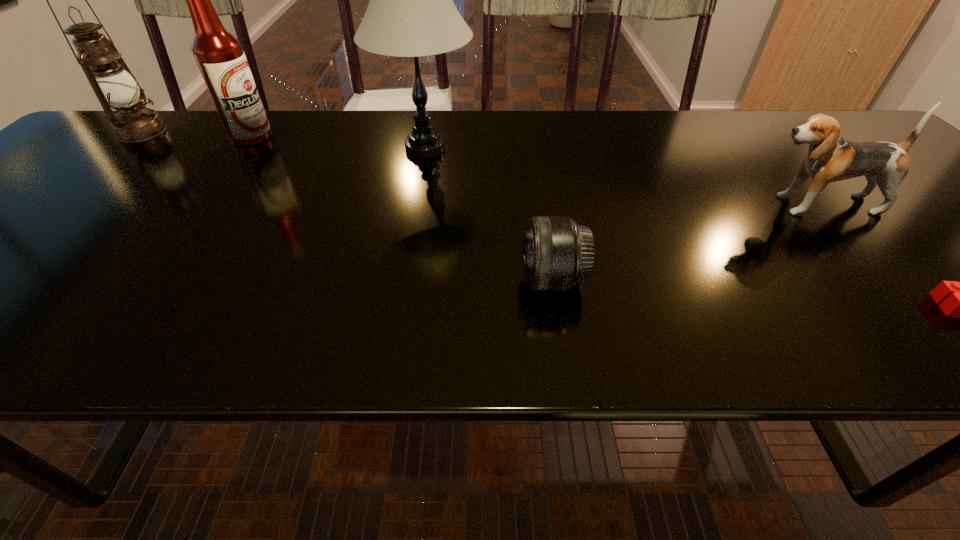
At what (x,y) coordinates should I click in order to perform the action: click on the fourth object from right to left. Please return your answer as a coordinate pair (x, y). The height and width of the screenshot is (540, 960). Looking at the image, I should click on (410, 13).

This screenshot has height=540, width=960. Identify the location of alcohol. (219, 55).

At what (x,y) coordinates should I click in order to perform the action: click on oil lamp. Please return your answer as a coordinate pair (x, y). The image size is (960, 540). Looking at the image, I should click on (115, 86).

I want to click on puppy, so click(830, 158).

Locate an element on the screen. The width and height of the screenshot is (960, 540). the third nearest object is located at coordinates (830, 158).

Where is `the fourth object from left to right`? the fourth object from left to right is located at coordinates (557, 253).

Image resolution: width=960 pixels, height=540 pixels. Identify the location of the fifth tallest object. (557, 253).

You are a GUI agent. You are given a task and a screenshot of the screen. Output one action in this format:
    pyautogui.click(x=<x>, y=<y>)
    Task: Click on the blank space located 0.300m on the left of the third object from left to right
    
    Given the screenshot: What is the action you would take?
    pyautogui.click(x=256, y=148)

At what (x,y) coordinates should I click in order to perform the action: click on vacant space located on the label side of the second object from left to right. Please return your answer as a coordinate pair (x, y). Looking at the image, I should click on (387, 137).

Where is `vacant area situated on the front of the leftmost object`? This screenshot has height=540, width=960. vacant area situated on the front of the leftmost object is located at coordinates (32, 232).